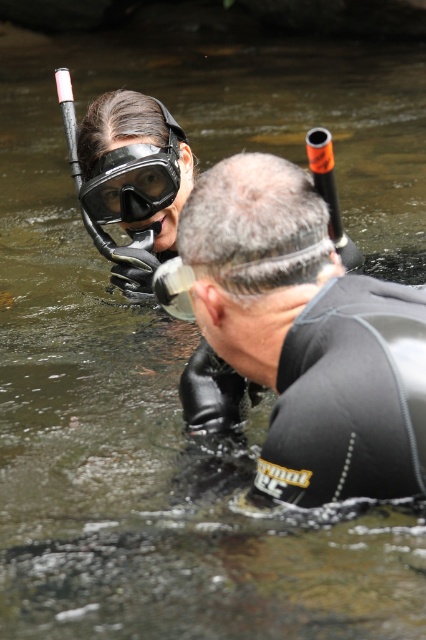
You are a scuba diver preparing to dive into the murky water shown in the scene. You notice a point marked at coordinates (307, 333). Based on the scene description, where is this point located?

The point at coordinates (307, 333) is located on the black rubber wetsuit at center.

You are a scuba diver preparing to enter the water. You see the black rubber wetsuit at center in the image. Can you estimate its coordinates to locate it?

The black rubber wetsuit at center is located at coordinates point (307, 333).

You are a marine biologist planning to swim between the black rubber wetsuit at center and the matte black goggles at upper left. Can you safely pass through the gap if your body requires 1.5 meters of space?

The distance between the black rubber wetsuit at center and the matte black goggles at upper left is 1.52 meters, which is just enough for your required 1.5 meters of space. You can safely pass through the gap.